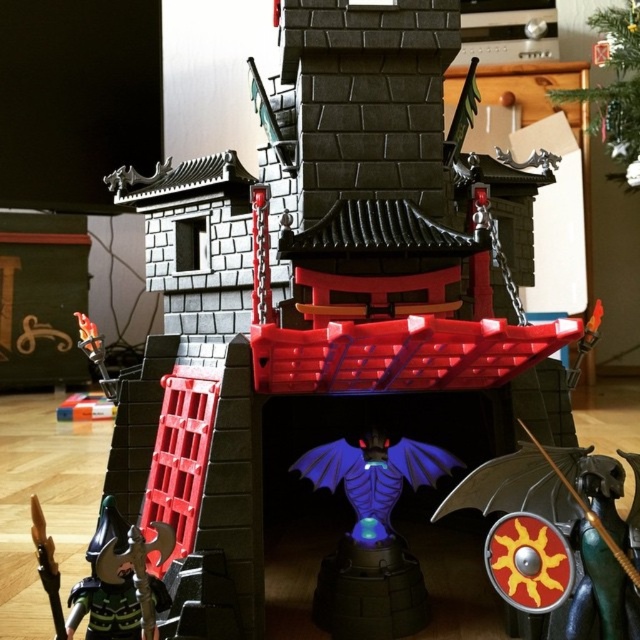
Question: Among these objects, which one is farthest from the camera?

Choices:
 (A) shiny metallic shield at center
 (B) blue translucent dragon at center
 (C) black plastic axe at lower left

Answer: (B)

Question: Which object is the farthest from the shiny metallic shield at center?

Choices:
 (A) black plastic axe at lower left
 (B) blue translucent dragon at center

Answer: (A)

Question: Can you confirm if shiny metallic shield at center is wider than blue translucent dragon at center?

Choices:
 (A) yes
 (B) no

Answer: (A)

Question: Can you confirm if shiny metallic shield at center is thinner than black plastic axe at lower left?

Choices:
 (A) no
 (B) yes

Answer: (A)

Question: Does shiny metallic shield at center have a lesser width compared to black plastic axe at lower left?

Choices:
 (A) yes
 (B) no

Answer: (B)

Question: Which object appears farthest from the camera in this image?

Choices:
 (A) blue translucent dragon at center
 (B) black plastic axe at lower left

Answer: (A)